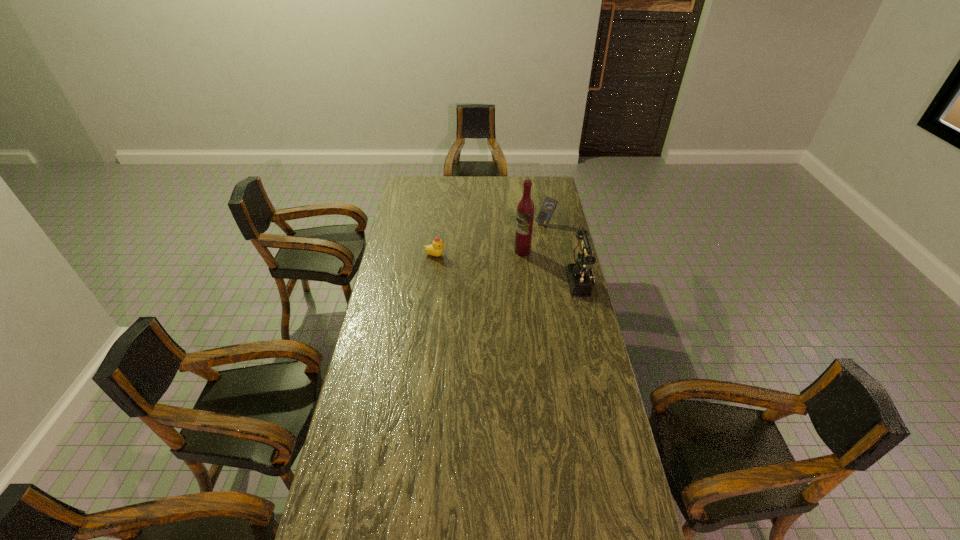
Where is `vacant space on the desktop that is between the shortest object and the third shortest object and is positioned on the front-facing side of the calculator`? The width and height of the screenshot is (960, 540). vacant space on the desktop that is between the shortest object and the third shortest object and is positioned on the front-facing side of the calculator is located at coordinates (498, 266).

Locate an element on the screen. free space on the desktop that is between the leftmost object and the telephone and is positioned on the label of the liquor is located at coordinates (486, 264).